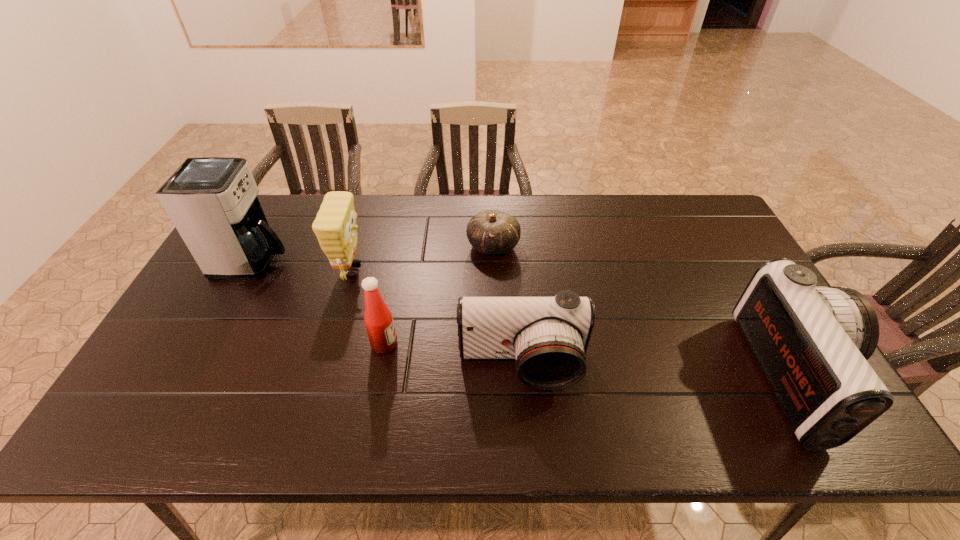
What are the coordinates of `the shorter camcorder` in the screenshot? It's located at (548, 336).

Find the location of a particular element. The image size is (960, 540). the right camcorder is located at coordinates (812, 343).

The image size is (960, 540). Identify the location of the rightmost object. (812, 343).

What are the coordinates of `sponge` in the screenshot? It's located at (335, 227).

Where is `the shortest object`? Image resolution: width=960 pixels, height=540 pixels. the shortest object is located at coordinates (490, 232).

The height and width of the screenshot is (540, 960). I want to click on the leftmost object, so click(x=212, y=201).

I want to click on coffee maker, so click(212, 201).

Identify the location of condiment. The width and height of the screenshot is (960, 540). (378, 319).

Identify the location of vacant space located on the face of the fifth object from right to left. The image size is (960, 540). pyautogui.click(x=483, y=269).

What are the coordinates of `blank area located 0.290m on the left of the gourd` in the screenshot? It's located at (377, 246).